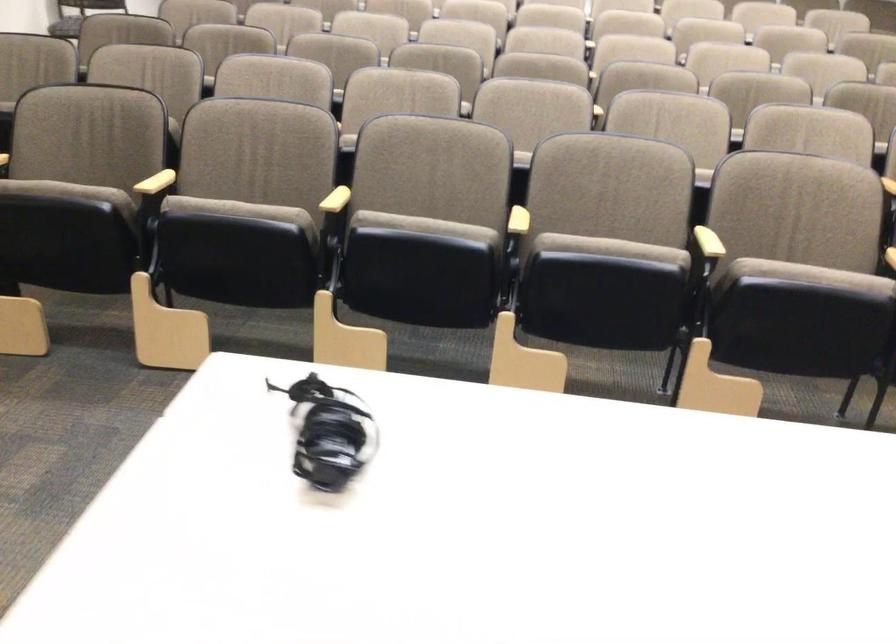
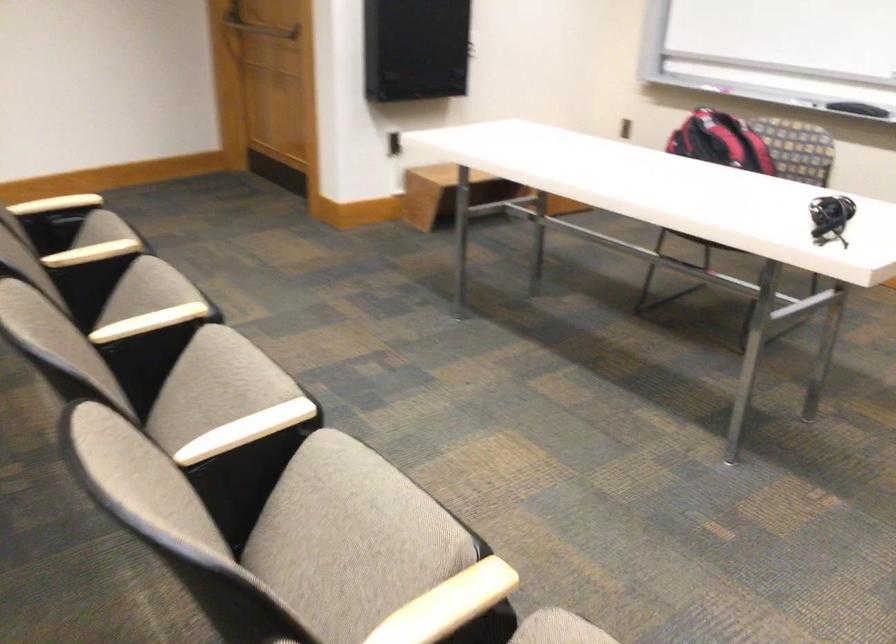
Locate, in the second image, the point that corresponds to (x=513, y=218) in the first image.

(245, 430)